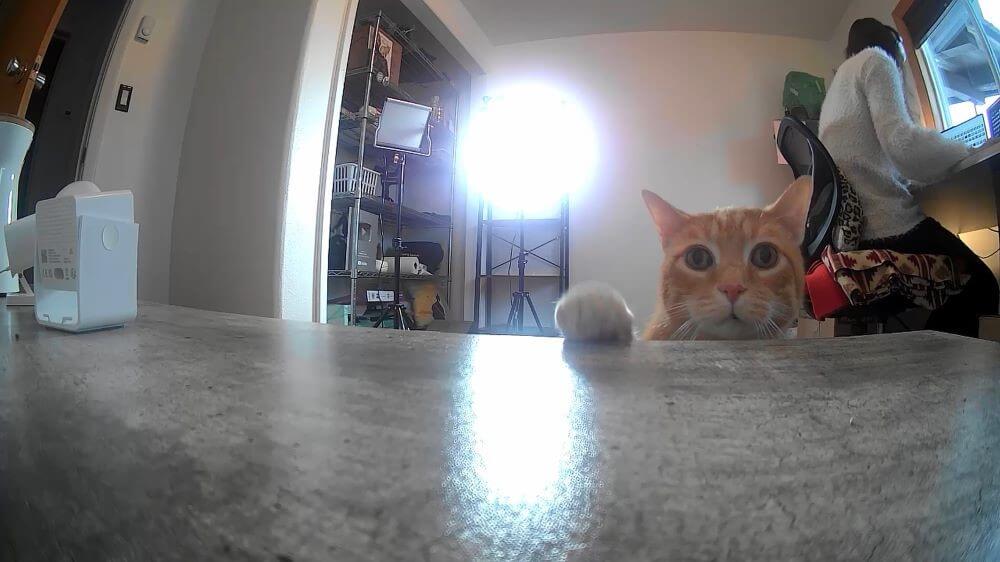
What are the coordinates of `countertop` in the screenshot? It's located at click(365, 420).